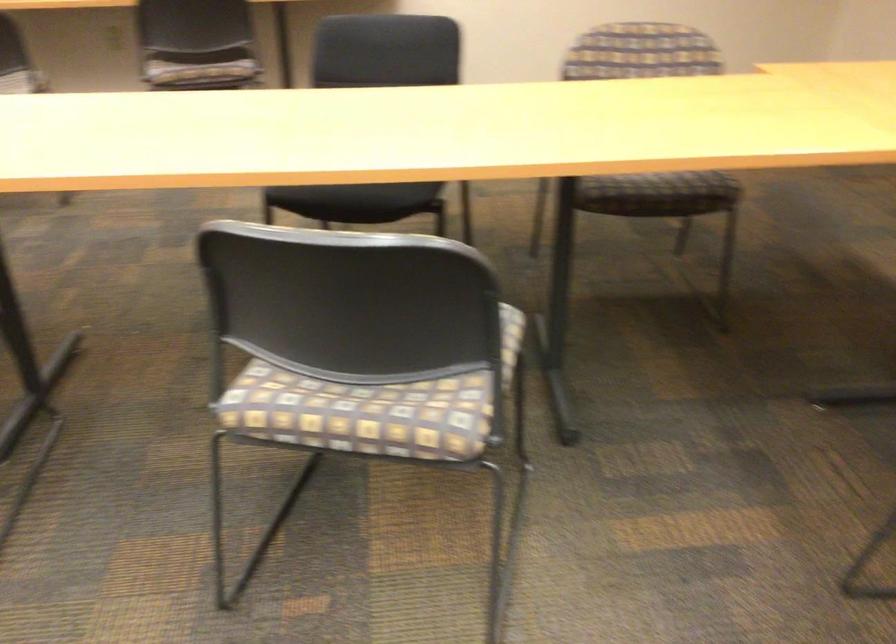
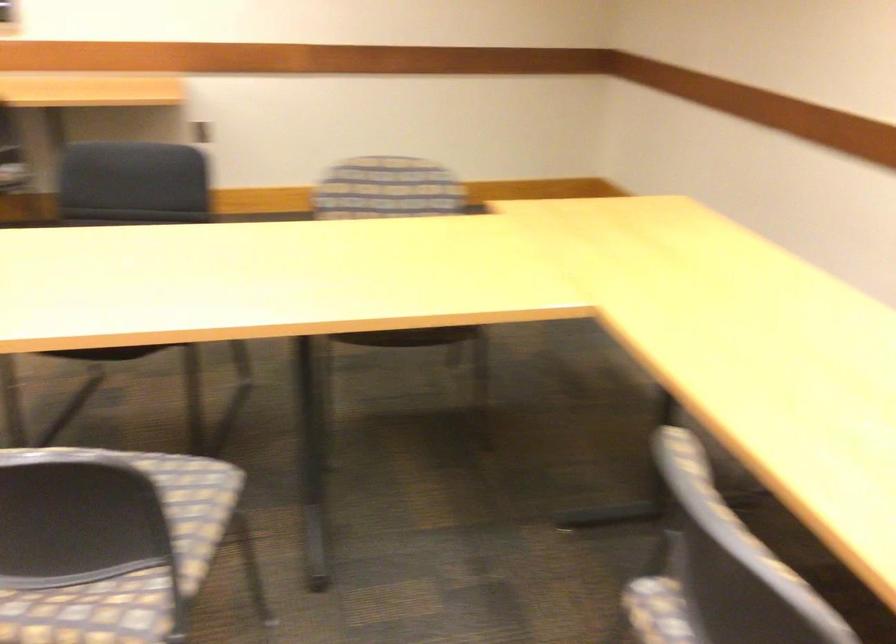
Question: I am providing you with two images of the same scene from different viewpoints. Please identify which objects are invisible in image2.

Choices:
 (A) striped chair sitting surface
 (B) dark chair sitting surface
 (C) black chair sitting surface
 (D) fire hose nozzle

Answer: (C)